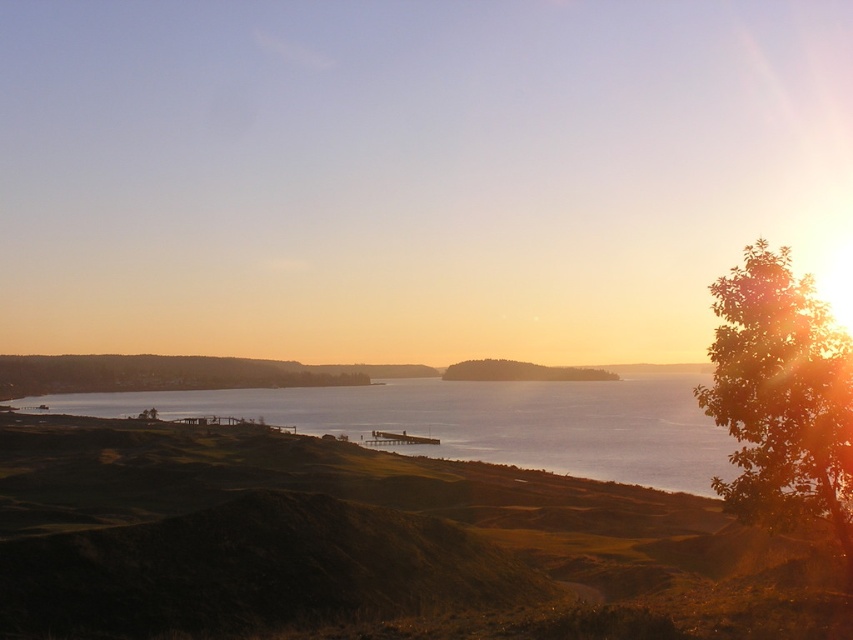
You are a hiker standing at the edge of the green grassy hillside at lower left and want to reach the green leafy tree at center. Which direction should you move to get closer to the tree?

The green grassy hillside at lower left is wider than the green leafy tree at center, so to reach the tree, you should move towards the center from the hillside.

You are standing on the green grassy hillside at lower left and want to see over the green leafy tree at right. Can you see the top of the tree from your current position?

The green grassy hillside at lower left is much taller than the green leafy tree at right, so you can see the top of the tree from your current position.